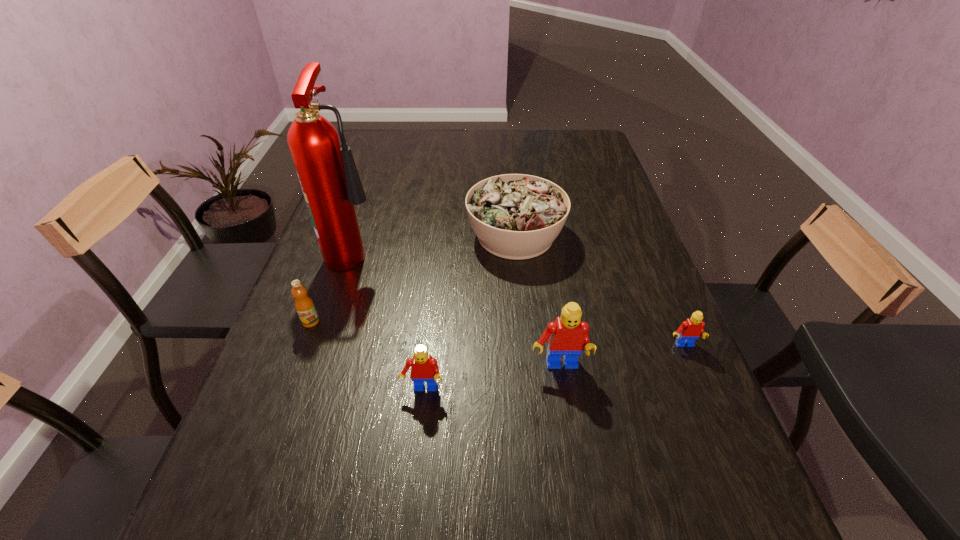
Find the location of a particular element. The height and width of the screenshot is (540, 960). free region located 0.140m on the front-facing side of the second nearest object is located at coordinates pyautogui.click(x=570, y=443).

The height and width of the screenshot is (540, 960). I want to click on free space located 0.090m on the front-facing side of the rightmost object, so click(x=701, y=387).

Where is `vacant area located 0.370m at the nozzle of the tallest object`? This screenshot has height=540, width=960. vacant area located 0.370m at the nozzle of the tallest object is located at coordinates (516, 251).

Find the location of `blank space located on the right of the salad`. blank space located on the right of the salad is located at coordinates (624, 236).

Find the location of a particular element. free location located on the front label of the fourth nearest object is located at coordinates (287, 384).

Find the location of a particular element. Image resolution: width=960 pixels, height=540 pixels. fire extinguisher situated at the left edge is located at coordinates (328, 175).

Identify the location of orange juice located in the left edge section of the desktop. (304, 305).

Locate an element on the screen. object present at the right edge is located at coordinates (691, 329).

Image resolution: width=960 pixels, height=540 pixels. In the image, there is a desktop. What are the coordinates of `free space at the far edge` in the screenshot? It's located at (497, 156).

Where is `free region at the near edge`? The width and height of the screenshot is (960, 540). free region at the near edge is located at coordinates (555, 466).